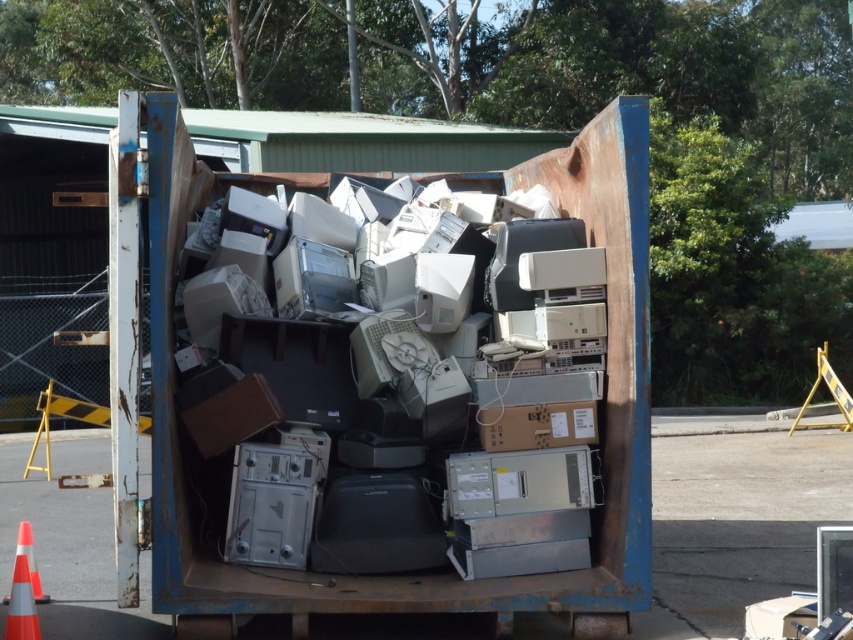
Looking at this image, is orange reflective cone at lower left smaller than orange/reflective traffic cone at lower left?

Yes, orange reflective cone at lower left is smaller than orange/reflective traffic cone at lower left.

Is point (28, 632) positioned in front of point (35, 592)?

Yes, point (28, 632) is closer to viewer.

The image size is (853, 640). I want to click on orange reflective cone at lower left, so click(21, 604).